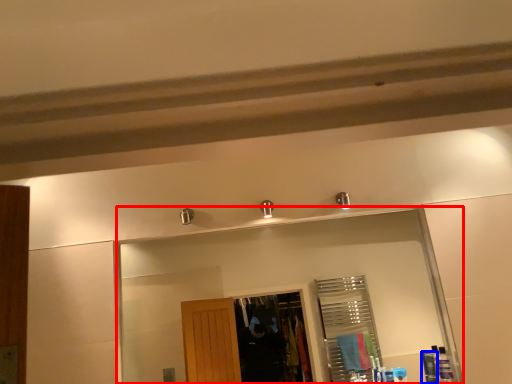
Question: Among these objects, which one is farthest to the camera, mirror (highlighted by a red box) or toiletry (highlighted by a blue box)?

Choices:
 (A) mirror
 (B) toiletry

Answer: (B)